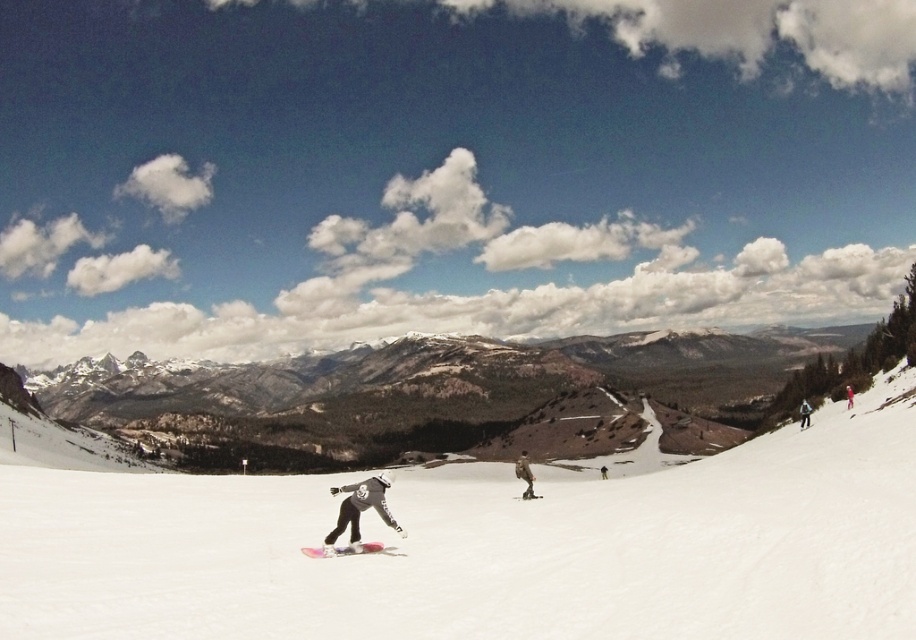
Question: Which point is farther to the camera?

Choices:
 (A) matte pink snowboard at center
 (B) pink matte snowboard at center
 (C) white snowboard at center
 (D) matte black snowboarder at center

Answer: (A)

Question: Can you confirm if pink matte snowboard at center is positioned to the left of white matte snowboard at center?

Choices:
 (A) yes
 (B) no

Answer: (B)

Question: Does gray fabric jacket at right appear on the left side of red fabric jacket at right?

Choices:
 (A) yes
 (B) no

Answer: (A)

Question: Which is nearer to the white matte snowboard at center?

Choices:
 (A) matte black snowboarder at center
 (B) camouflage fabric jacket at center
 (C) red fabric jacket at right

Answer: (A)

Question: In this image, where is pink matte snowboard at center located relative to red fabric jacket at right?

Choices:
 (A) right
 (B) left

Answer: (B)

Question: Which of the following is the farthest from the observer?

Choices:
 (A) matte pink snowboard at right
 (B) camouflage fabric jacket at center

Answer: (A)